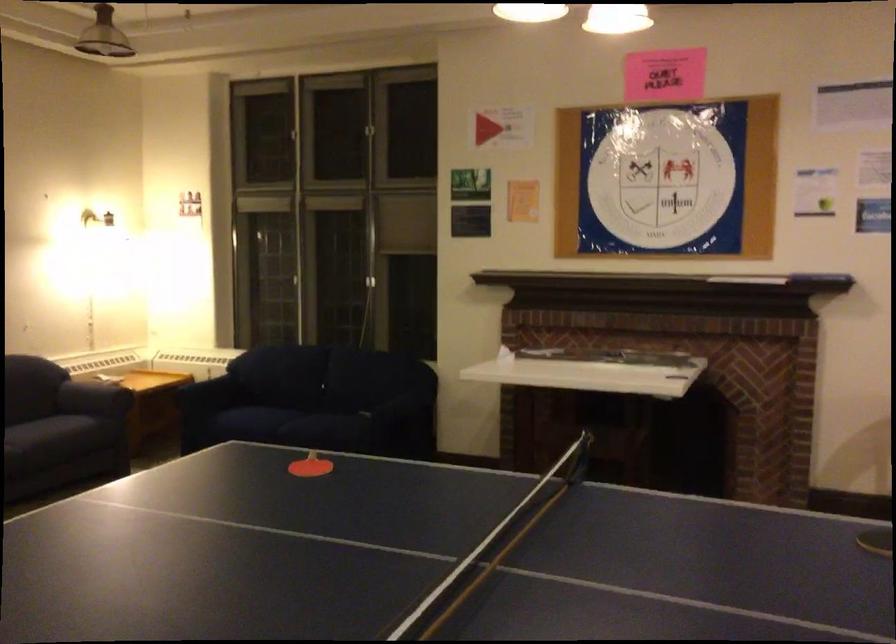
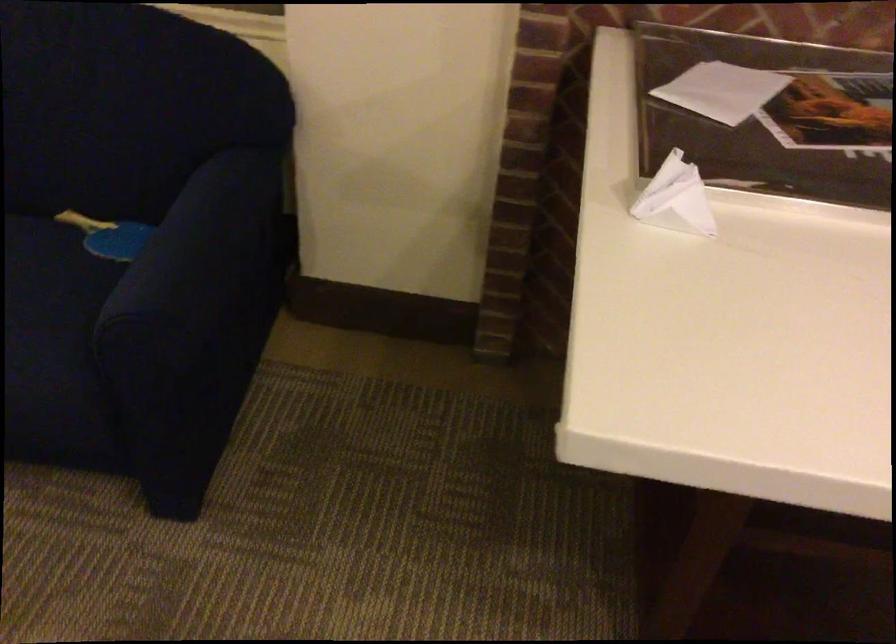
Where in the second image is the point corresponding to [531,355] from the first image?

(675, 199)